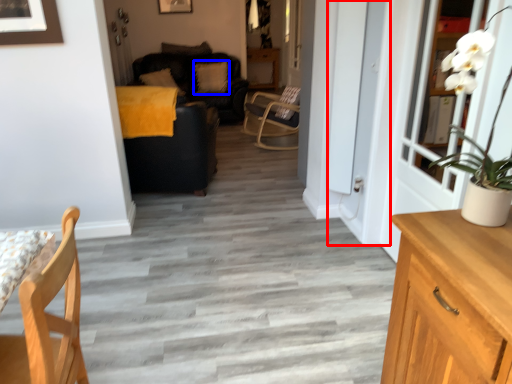
Question: Which object is further to the camera taking this photo, screen door (highlighted by a red box) or pillow (highlighted by a blue box)?

Choices:
 (A) screen door
 (B) pillow

Answer: (B)